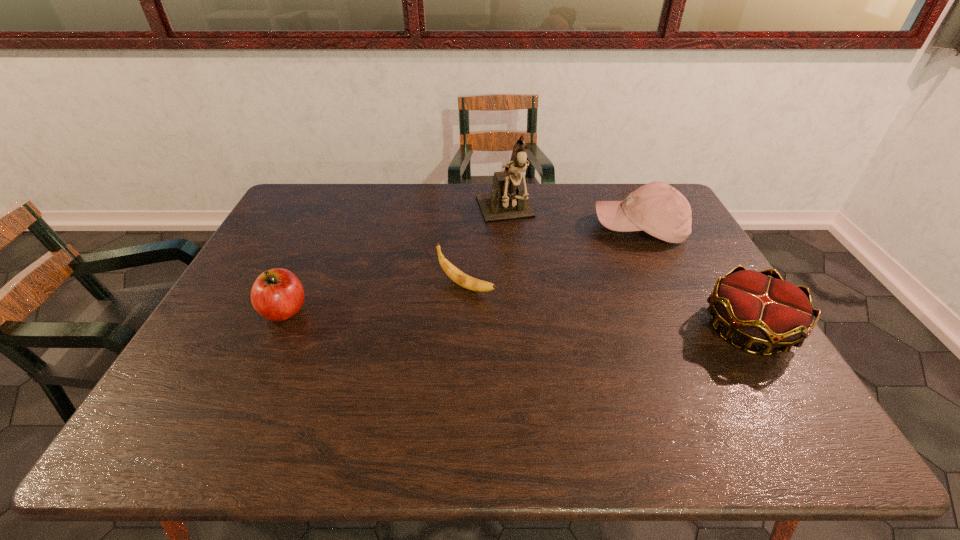
Where is `free space in the image that satisfies the following two spatial constraints: 1. on the front side of the tallest object; 2. on the left side of the crown`? This screenshot has width=960, height=540. free space in the image that satisfies the following two spatial constraints: 1. on the front side of the tallest object; 2. on the left side of the crown is located at coordinates (515, 328).

The width and height of the screenshot is (960, 540). I want to click on vacant position in the image that satisfies the following two spatial constraints: 1. on the back side of the banana; 2. on the left side of the tallest object, so click(468, 214).